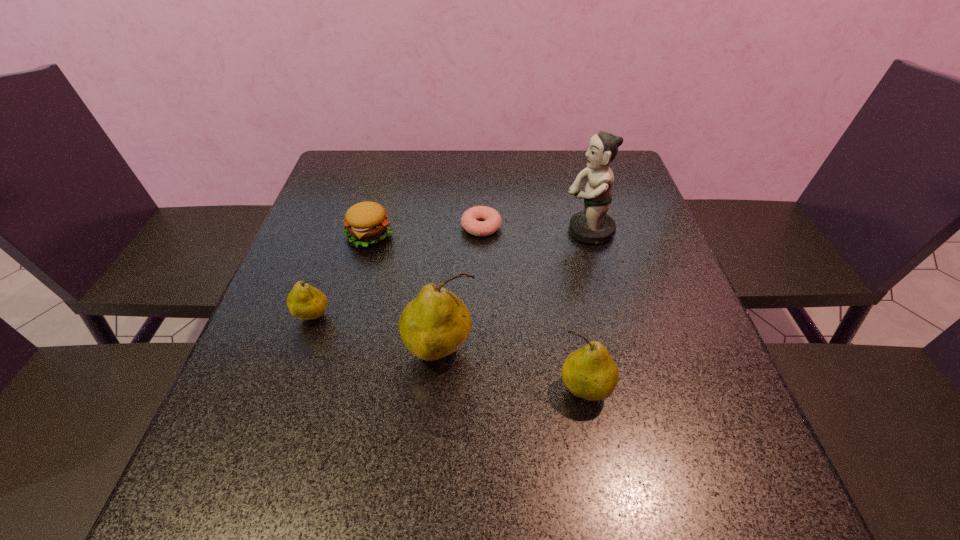
In the current image, all pears are evenly spaced. To maintain this equal spacing, where should an additional pear be placed on the right? Please point out a free spot. Please provide its 2D coordinates. Your answer should be formatted as a tuple, i.e. [(x, y)], where the tuple contains the x and y coordinates of a point satisfying the conditions above.

[(754, 436)]